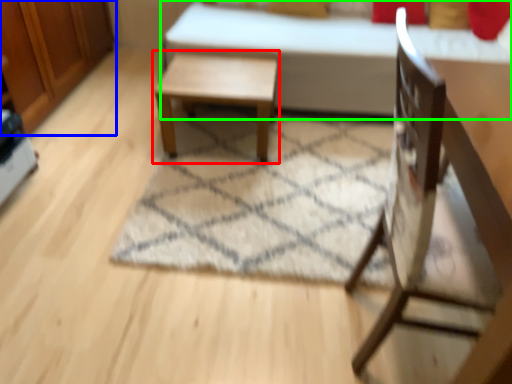
Question: Based on their relative distances, which object is nearer to table (highlighted by a red box)? Choose from dresser (highlighted by a blue box) and bed (highlighted by a green box).

Choices:
 (A) dresser
 (B) bed

Answer: (B)